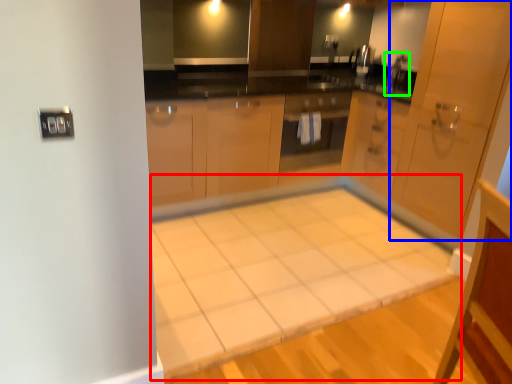
Question: Based on their relative distances, which object is farther from table (highlighted by a red box)? Choose from door (highlighted by a blue box) and faucet (highlighted by a green box).

Choices:
 (A) door
 (B) faucet

Answer: (B)